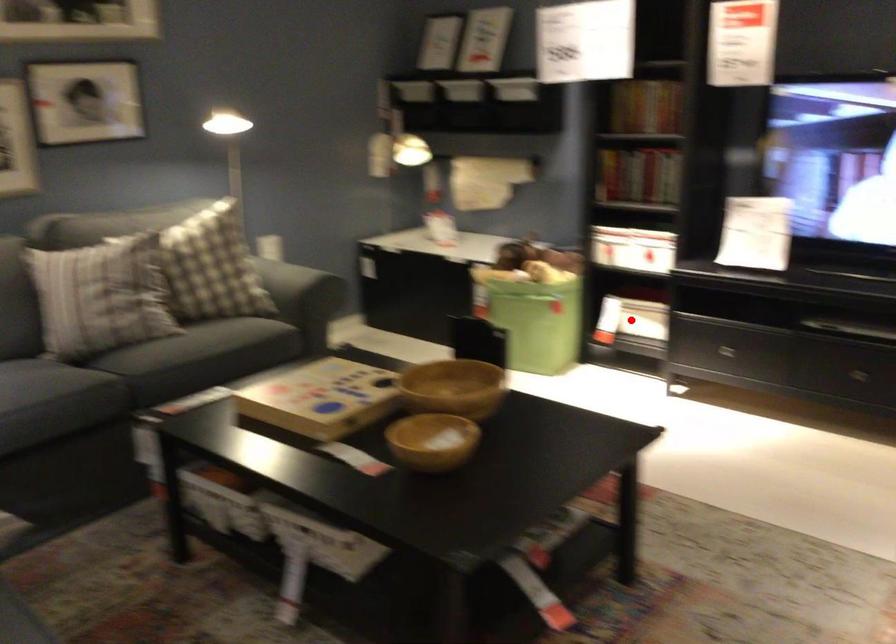
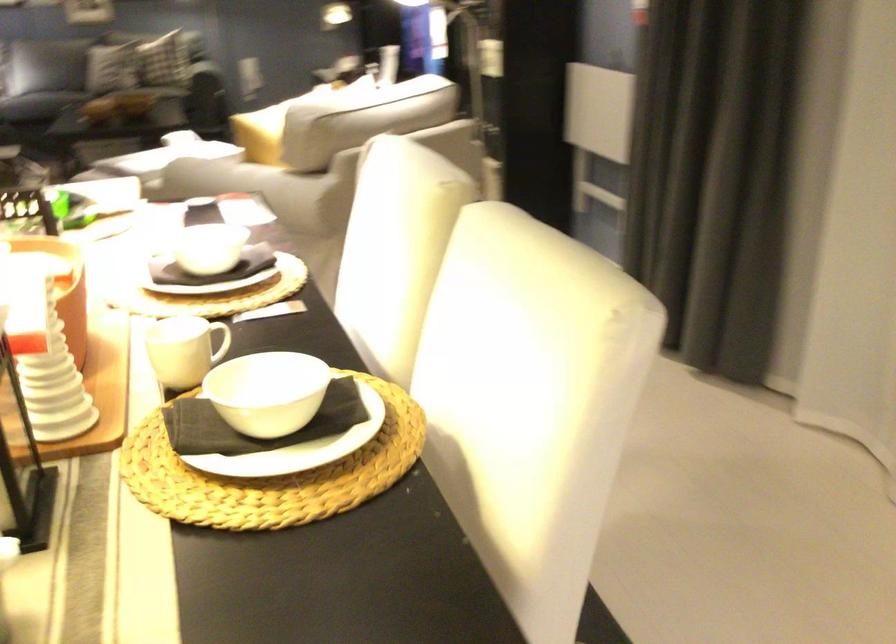
Question: I am providing you with two images of the same scene from different viewpoints. A red point is marked on the first image. At the location where the point appears in image 1, is it still visible in image 2?

Choices:
 (A) Yes
 (B) No

Answer: (B)